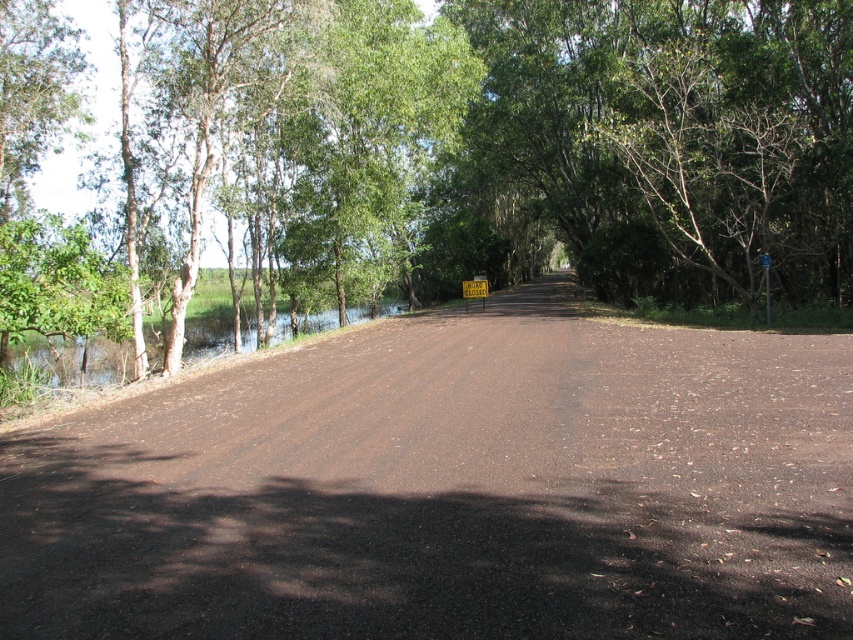
Can you confirm if brown gravel road at center is positioned to the right of green leafy water at left?

Yes, brown gravel road at center is to the right of green leafy water at left.

Who is more forward, (35, 600) or (152, 371)?

Positioned in front is point (35, 600).

What do you see at coordinates (450, 488) in the screenshot? This screenshot has height=640, width=853. I see `brown gravel road at center` at bounding box center [450, 488].

You are a GUI agent. You are given a task and a screenshot of the screen. Output one action in this format:
    pyautogui.click(x=<x>, y=<y>)
    Task: Click on the brown gravel road at center
    The height and width of the screenshot is (640, 853).
    Given the screenshot: What is the action you would take?
    click(x=450, y=488)

Which of these two, green leafy tree at center or green leafy water at left, stands shorter?

green leafy water at left

Which is behind, point (669, 289) or point (306, 332)?

Positioned behind is point (669, 289).

Where is `green leafy tree at center`? This screenshot has height=640, width=853. green leafy tree at center is located at coordinates [x=438, y=154].

Between brown gravel road at center and yellow plastic sign at center, which one has more height?

Standing taller between the two is yellow plastic sign at center.

Is point (126, 582) closer to camera compared to point (762, 256)?

That is True.

Which is behind, point (563, 276) or point (769, 262)?

The point (563, 276) is more distant.

This screenshot has height=640, width=853. I want to click on brown gravel road at center, so click(x=450, y=488).